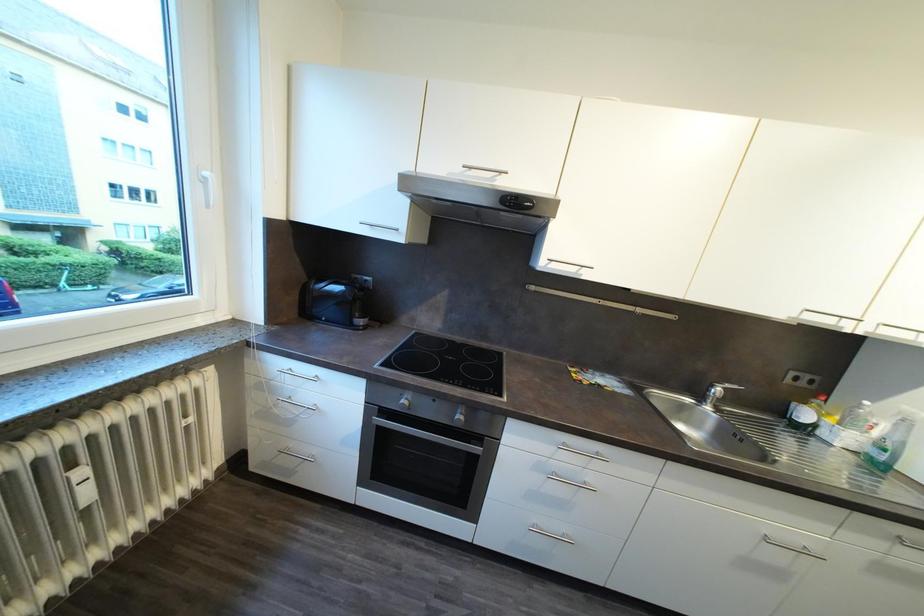
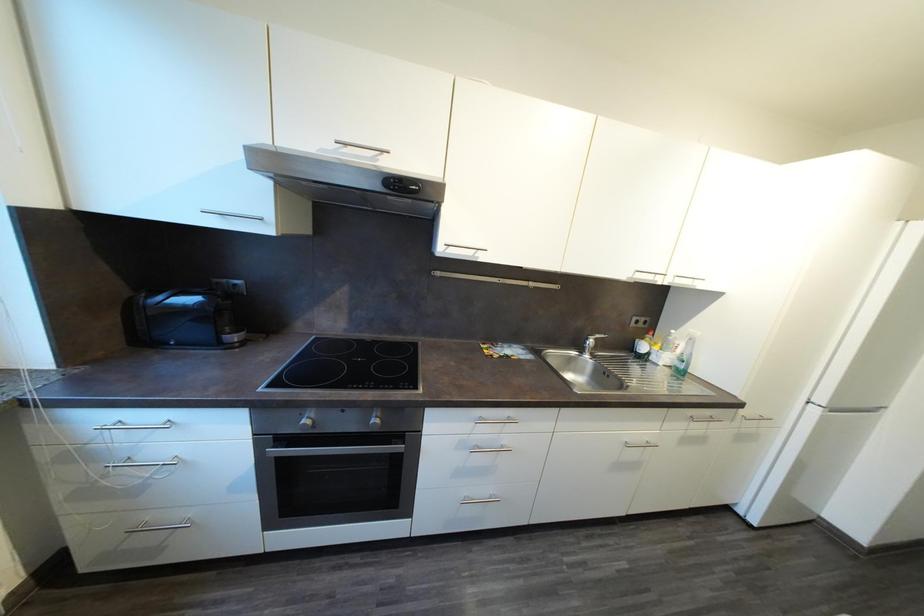
Question: Which direction would the cameraman need to move to produce the second image? Reply with the corresponding letter.

Choices:
 (A) Left
 (B) Right
 (C) Forward
 (D) Backward

Answer: (B)